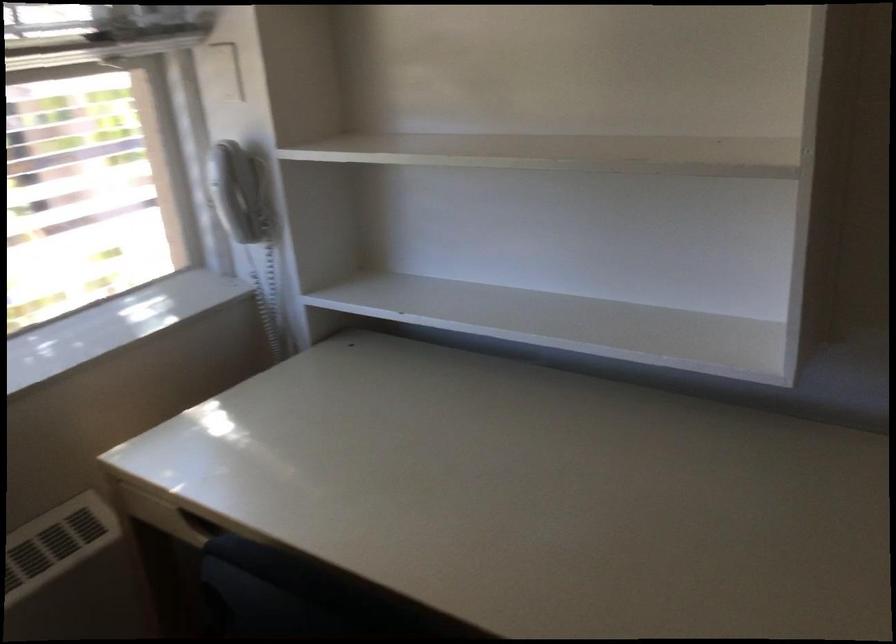
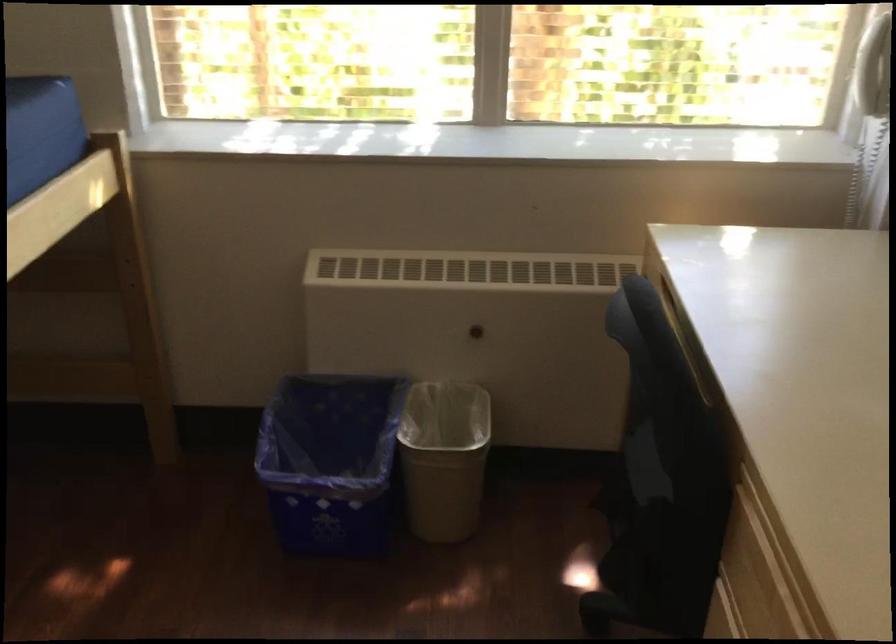
In the second image, find the point that corresponds to pixel 237 205 in the first image.

(874, 69)